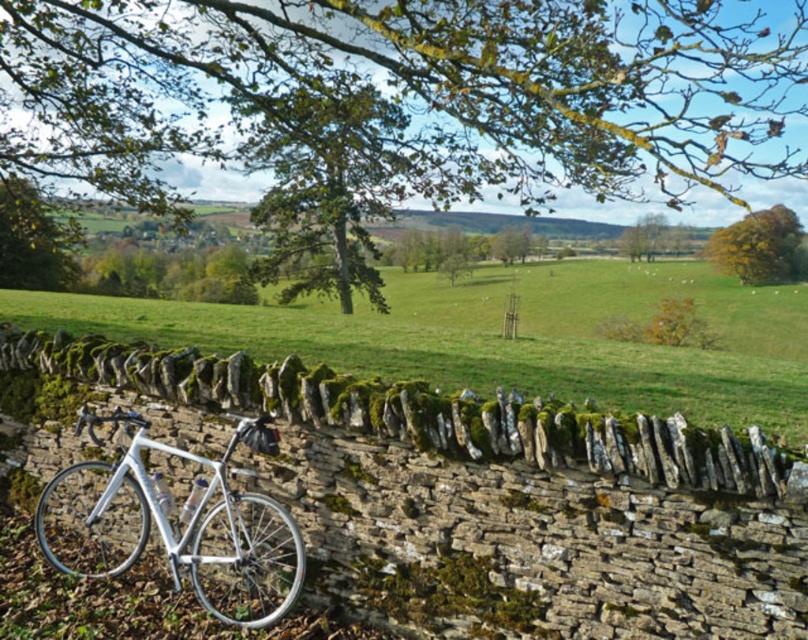
Question: Where is green leafy tree at center located in relation to white metallic bicycle at lower left in the image?

Choices:
 (A) below
 (B) above

Answer: (B)

Question: Does green leafy tree at center appear on the left side of white metallic bicycle at lower left?

Choices:
 (A) yes
 (B) no

Answer: (B)

Question: Is green leafy tree at center wider than golden-brown textured tree at upper right?

Choices:
 (A) no
 (B) yes

Answer: (B)

Question: Which point is closer to the camera?

Choices:
 (A) green mossy stone wall at lower center
 (B) green leafy tree at center
 (C) white metallic bicycle at lower left
 (D) golden-brown textured tree at upper right

Answer: (B)

Question: Considering the real-world distances, which object is closest to the green leafy tree at center?

Choices:
 (A) green mossy stone wall at lower center
 (B) white metallic bicycle at lower left

Answer: (A)

Question: Which point is farther from the camera taking this photo?

Choices:
 (A) (390, 342)
 (B) (712, 260)
 (C) (251, 566)

Answer: (B)